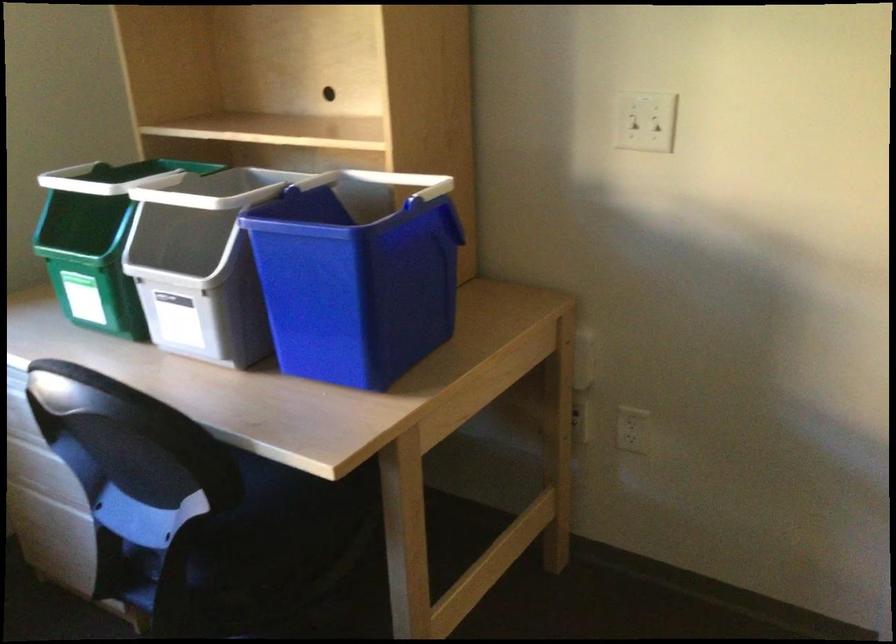
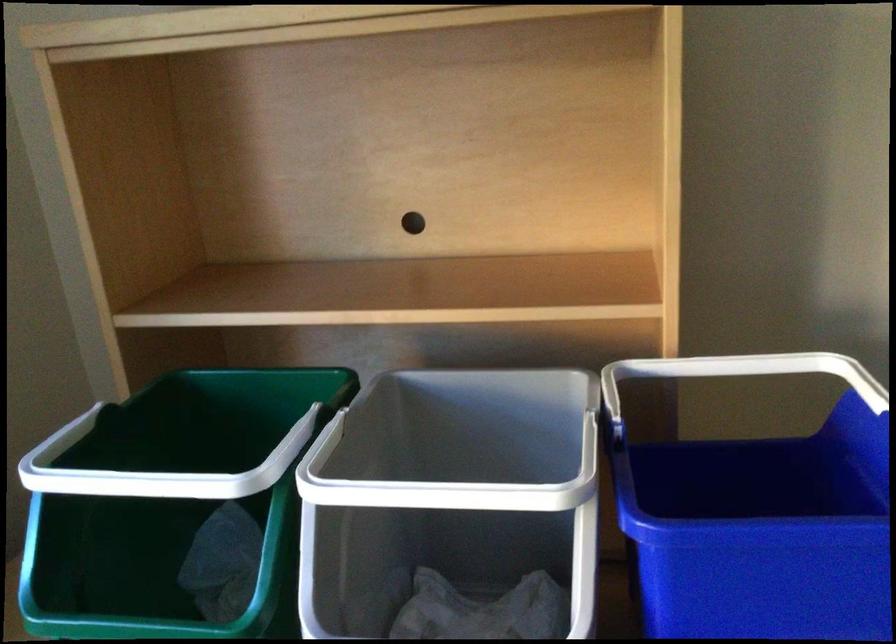
Which direction would the cameraman need to move to produce the second image?

The cameraman walked toward left, forward.